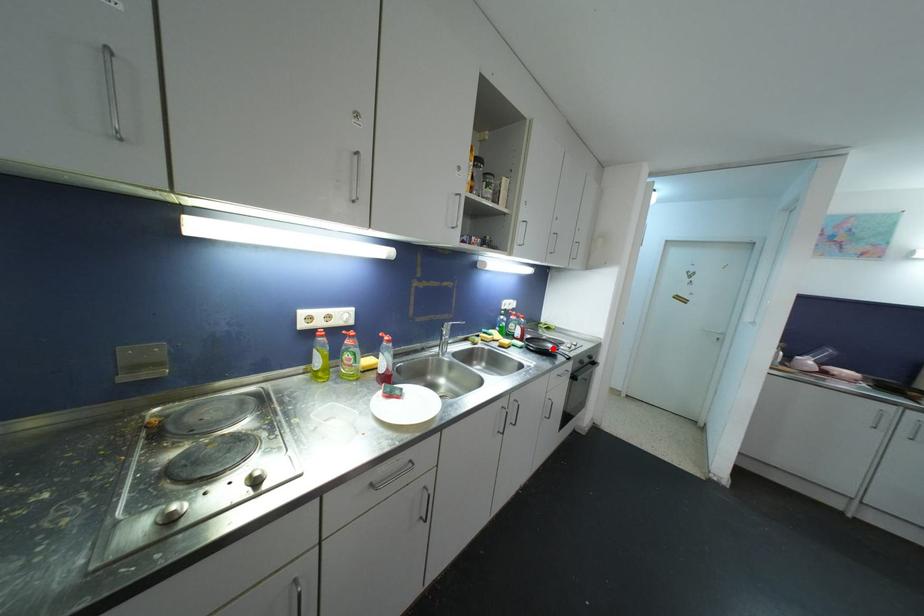
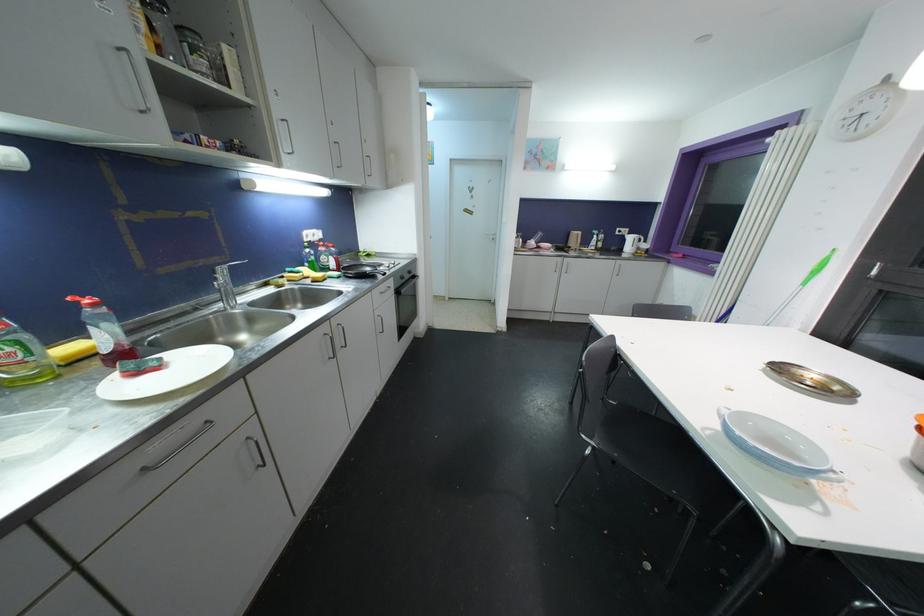
Where in the second image is the point corresponding to the highlighted location from the first image?

(371, 272)